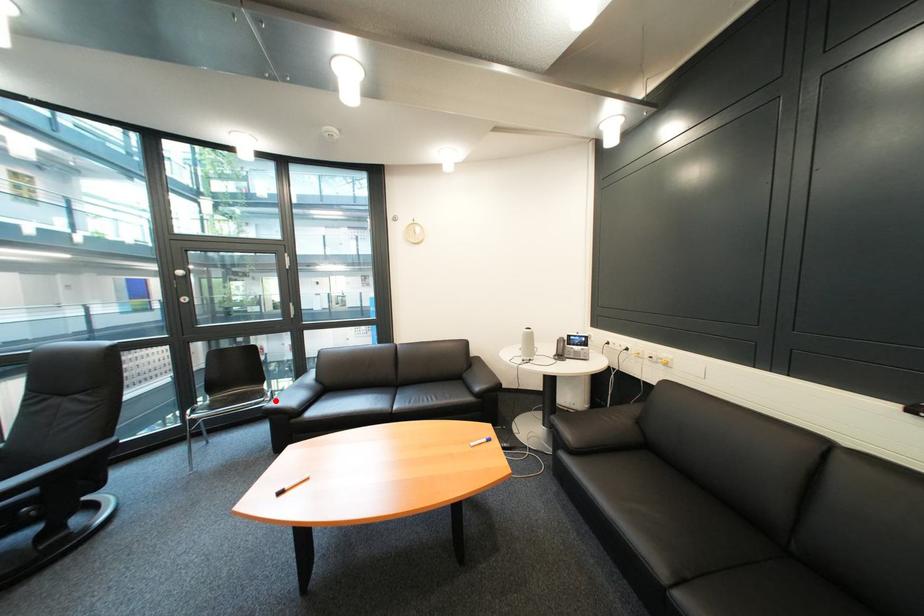
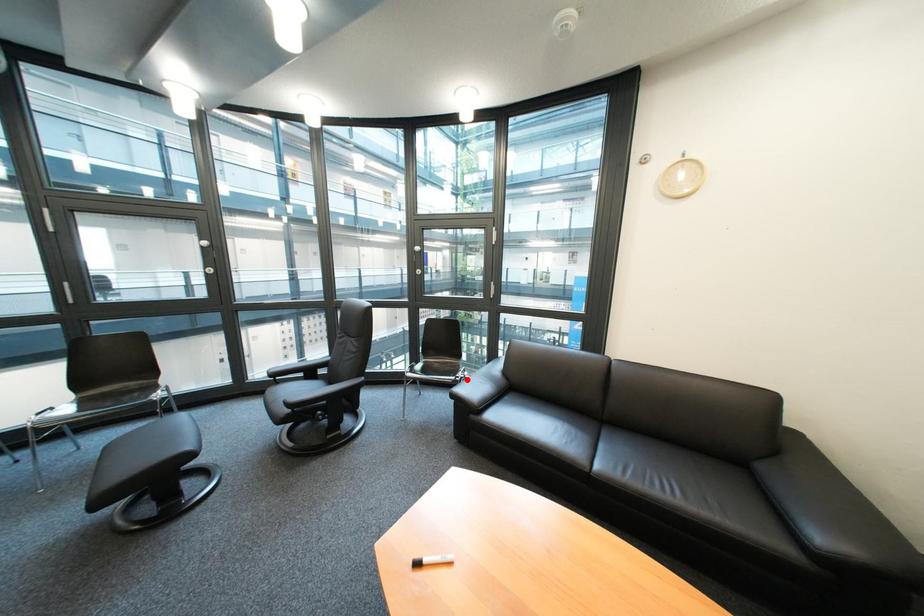
I am providing you with two images of the same scene from different viewpoints. A red point is marked on the first image and another point is marked on the second image. Do the highlighted points in image1 and image2 indicate the same real-world spot?

Yes